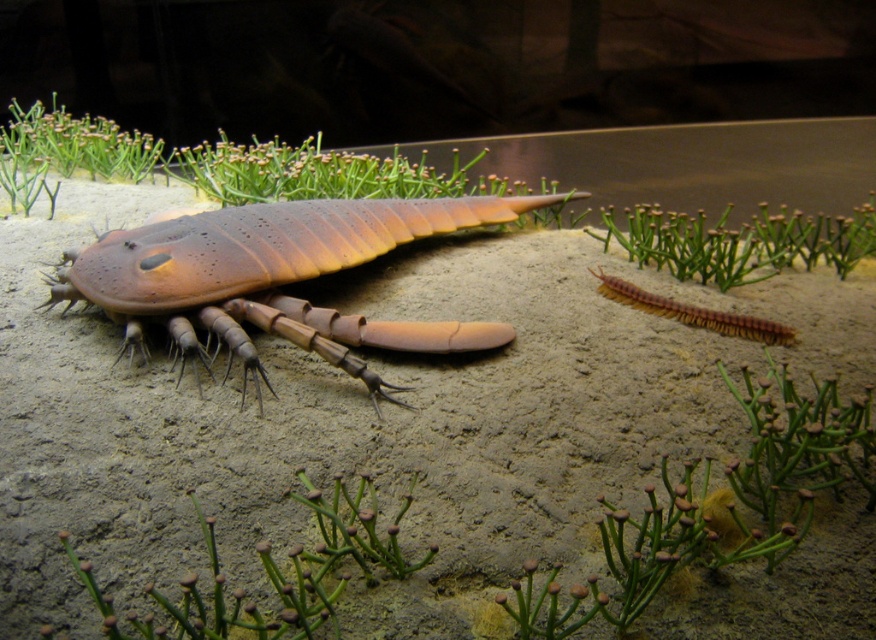
Does matte brown crustacean at center have a lesser width compared to brown fuzzy centipede at lower right?

No, matte brown crustacean at center is not thinner than brown fuzzy centipede at lower right.

Can you confirm if matte brown crustacean at center is smaller than brown fuzzy centipede at lower right?

No, matte brown crustacean at center is not smaller than brown fuzzy centipede at lower right.

Who is more forward, (x=302, y=241) or (x=670, y=316)?

Point (x=302, y=241) is in front.

Find the location of a particular element. Image resolution: width=876 pixels, height=640 pixels. matte brown crustacean at center is located at coordinates (288, 269).